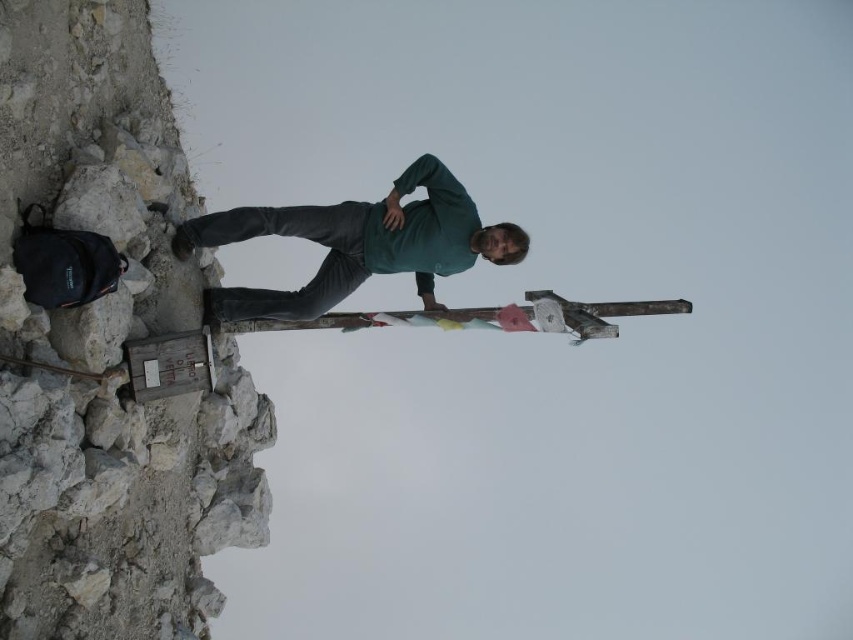
You are a photographer trying to capture the rough stone cliff at left and the green matte shirt at center in the same frame. Given their sizes, which object should you focus on to ensure both are visible without cropping?

Since the rough stone cliff at left is larger than the green matte shirt at center, you should focus on the rough stone cliff at left to ensure both are visible in the frame.

Based on the scene description, where exactly is the rough stone cliff at left located in terms of coordinates?

The rough stone cliff at left is located at coordinates point [125,502].